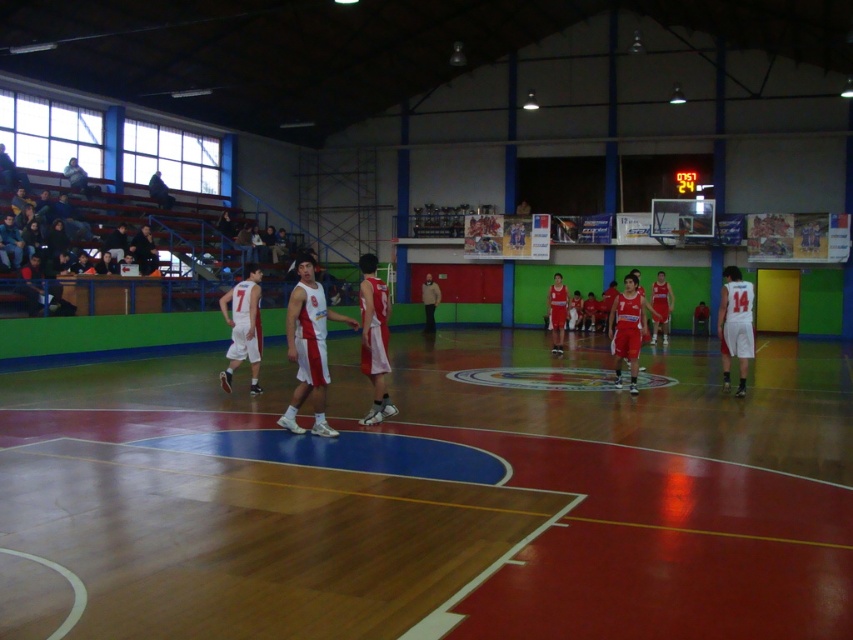
You are a photographer standing at the back of the gymnasium. You want to capture a photo that includes both the red jersey basketball player at center and the white matte basketball player at right. Based on their sizes in the image, which player should you focus on first to ensure both are in frame?

The red jersey basketball player at center occupies less space than the white matte basketball player at right, so you should focus on the white matte basketball player at right first to ensure both are in frame.